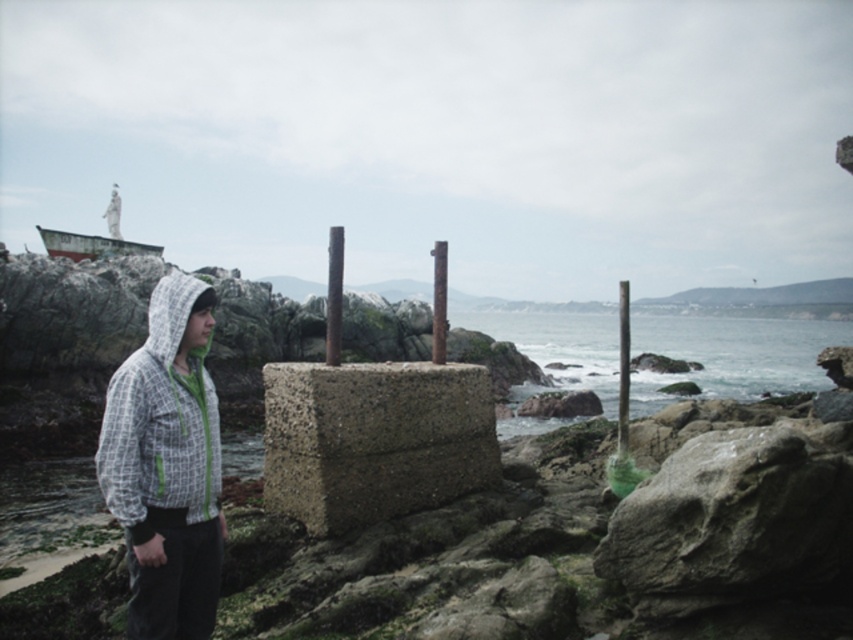
Question: Is brown wood post at center to the right of smooth concrete pillar at right from the viewer's perspective?

Choices:
 (A) no
 (B) yes

Answer: (A)

Question: Observing the image, what is the correct spatial positioning of white checkered hoodie at left in reference to smooth concrete pillar at center?

Choices:
 (A) right
 (B) left

Answer: (B)

Question: Can you confirm if smooth concrete pillar at right is bigger than smooth concrete pillar at center?

Choices:
 (A) no
 (B) yes

Answer: (B)

Question: Estimate the real-world distances between objects in this image. Which object is farther from the white fleece hoodie at left?

Choices:
 (A) gray concrete block at center
 (B) brown wood post at center
 (C) smooth concrete pillar at right

Answer: (B)

Question: Which point is farther to the camera?

Choices:
 (A) (332, 244)
 (B) (636, 490)

Answer: (A)

Question: Which is farther from the gray rough rock at lower right?

Choices:
 (A) gray concrete block at center
 (B) brown wood post at center
 (C) white checkered hoodie at left

Answer: (B)